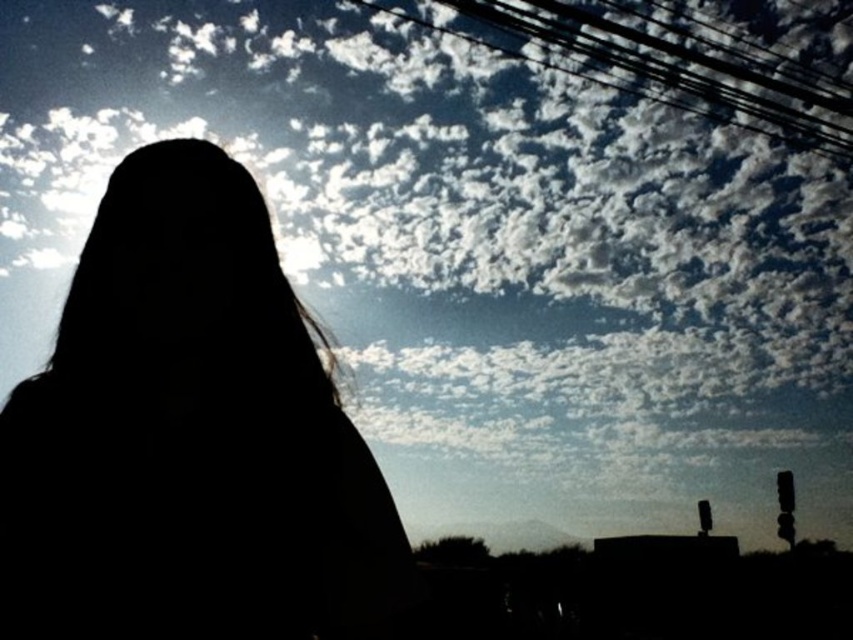
You are an artist trying to sketch the silhouette of the person in the scene. To accurately place the black hair at center, where should you position it on your canvas using coordinates?

The black hair at center should be positioned at coordinates point (x=189, y=436) on the canvas.

Based on the photo, you are standing in a field and see the black hair at center and the black wire at upper center in the sky. You want to hang a birdhouse between them. Is there enough space to place the birdhouse between them?

The distance between the black hair at center and the black wire at upper center is 5.97 meters, so yes, there is enough space to place the birdhouse between them.